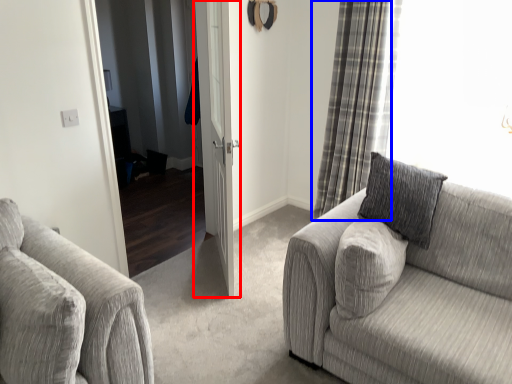
Question: Which of the following is the closest to the observer, door (highlighted by a red box) or curtain (highlighted by a blue box)?

Choices:
 (A) door
 (B) curtain

Answer: (A)